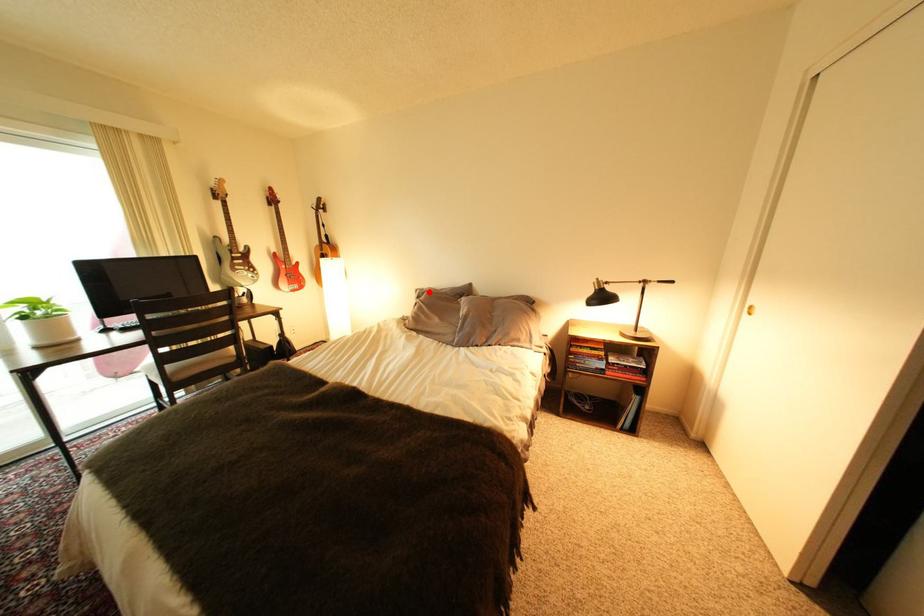
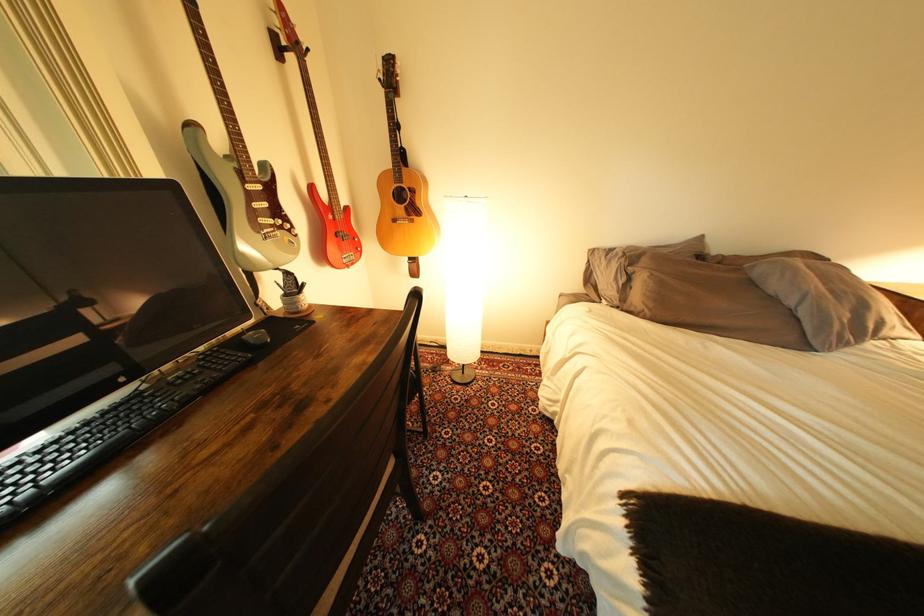
Question: I am providing you with two images of the same scene from different viewpoints. In image1, a red point is highlighted. Considering the same 3D point in image2, which of the following is correct?

Choices:
 (A) It is closer
 (B) It is farther

Answer: (A)